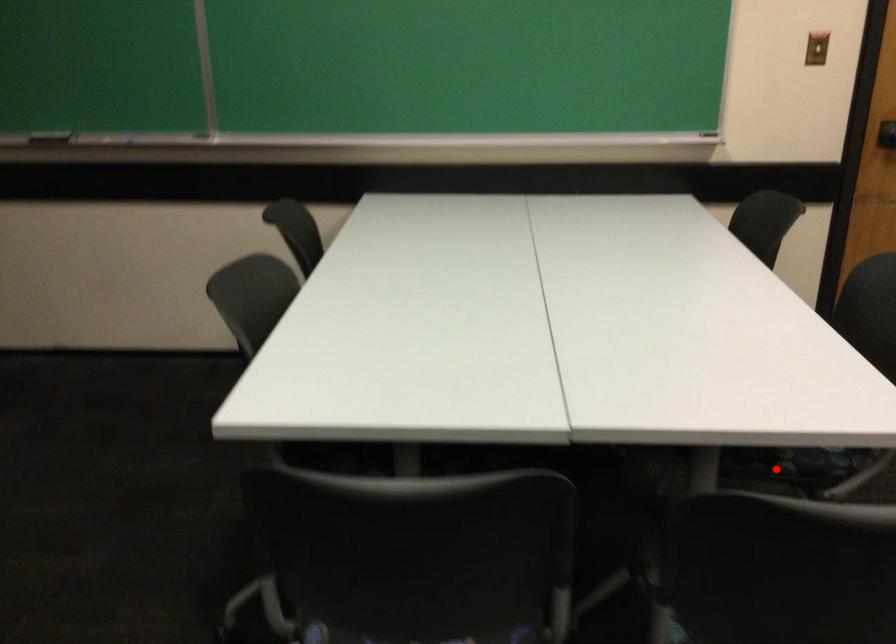
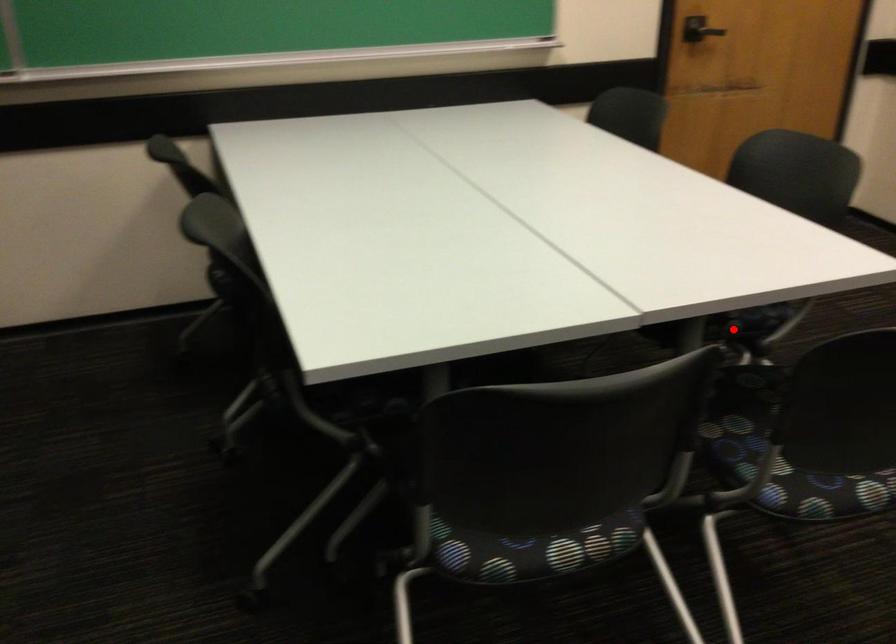
I am providing you with two images of the same scene from different viewpoints. A red point is marked on the first image and another point is marked on the second image. Are the points marked in image1 and image2 representing the same 3D position?

Yes